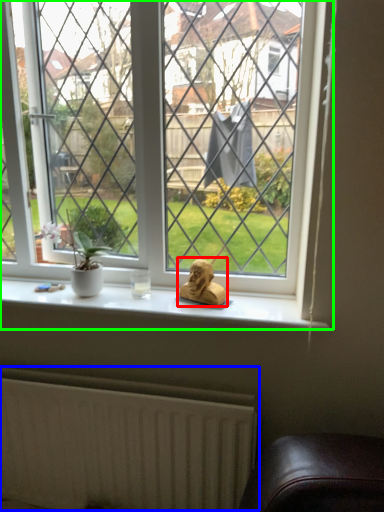
Question: Based on their relative distances, which object is farther from animal (highlighted by a red box)? Choose from radiator (highlighted by a blue box) and window (highlighted by a green box).

Choices:
 (A) radiator
 (B) window

Answer: (A)